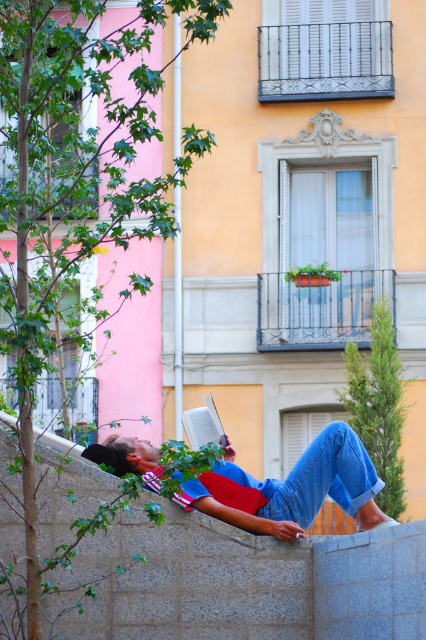
Question: Which of the following is the closest to the observer?

Choices:
 (A) gray concrete wall at center
 (B) denim jeans at lower center

Answer: (B)

Question: Which point is closer to the camera?

Choices:
 (A) gray concrete wall at center
 (B) blue denim jeans at lower center

Answer: (A)

Question: Can you confirm if gray concrete wall at center is positioned to the left of denim jeans at lower center?

Choices:
 (A) no
 (B) yes

Answer: (A)

Question: Can you confirm if gray concrete wall at center is positioned below blue denim jeans at lower center?

Choices:
 (A) yes
 (B) no

Answer: (A)

Question: Which object appears closest to the camera in this image?

Choices:
 (A) denim jeans at lower center
 (B) blue denim jeans at lower center
 (C) gray concrete wall at center

Answer: (A)

Question: Does denim jeans at lower center have a lesser width compared to blue denim jeans at lower center?

Choices:
 (A) no
 (B) yes

Answer: (A)